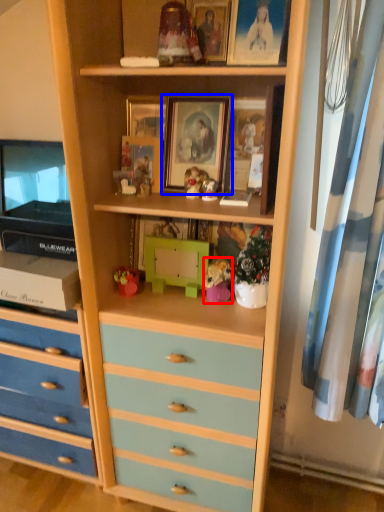
Question: Which point is further to the camera, toy (highlighted by a red box) or picture frame (highlighted by a blue box)?

Choices:
 (A) toy
 (B) picture frame

Answer: (A)